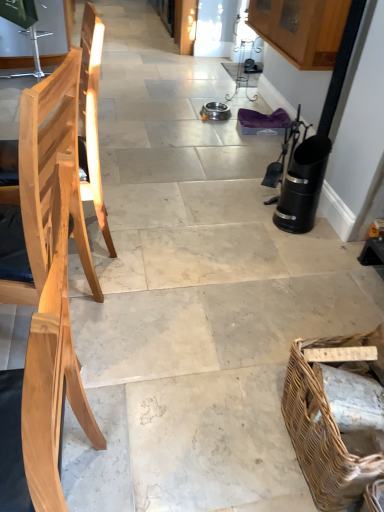
What do you see at coordinates (92, 118) in the screenshot? I see `natural wood chair at left, marked as the first chair in a back-to-front arrangement` at bounding box center [92, 118].

Locate an element on the screen. The image size is (384, 512). natural wood chair at left, acting as the first chair starting from the bottom is located at coordinates (47, 293).

The width and height of the screenshot is (384, 512). Identify the location of brown woven picnic basket at lower right. (324, 430).

In order to face brown woven picnic basket at lower right, should I rotate leftwards or rightwards?

You should look right and rotate roughly 22.971 degrees.

Where is `natural wood chair at left, which ranks as the second chair in front-to-back order`? natural wood chair at left, which ranks as the second chair in front-to-back order is located at coordinates (92, 118).

How distant is natural wood chair at left, the 2th chair in the top-to-bottom sequence, from natural wood chair at left, marked as the first chair in a back-to-front arrangement?

natural wood chair at left, the 2th chair in the top-to-bottom sequence, is 26.30 inches away from natural wood chair at left, marked as the first chair in a back-to-front arrangement.

Can you see natural wood chair at left, the 2th chair in the top-to-bottom sequence, touching natural wood chair at left, which ranks as the second chair in front-to-back order?

No, natural wood chair at left, the 2th chair in the top-to-bottom sequence, is not making contact with natural wood chair at left, which ranks as the second chair in front-to-back order.

This screenshot has width=384, height=512. In order to click on chair located on the left of natural wood chair at left, the 1th chair when ordered from front to back in this screenshot , I will do `click(92, 118)`.

From the image's perspective, is natural wood chair at left, acting as the first chair starting from the bottom, beneath natural wood chair at left, which ranks as the second chair in front-to-back order?

Indeed, from the image's perspective, natural wood chair at left, acting as the first chair starting from the bottom, is shown beneath natural wood chair at left, which ranks as the second chair in front-to-back order.

Considering the relative sizes of natural wood chair at left, the first chair positioned from the top, and brown woven picnic basket at lower right in the image provided, is natural wood chair at left, the first chair positioned from the top, shorter than brown woven picnic basket at lower right?

In fact, natural wood chair at left, the first chair positioned from the top, may be taller than brown woven picnic basket at lower right.

From the image's perspective, which one is positioned lower, natural wood chair at left, the first chair positioned from the top, or brown woven picnic basket at lower right?

From the image's view, brown woven picnic basket at lower right is below.

In the image, there is a natural wood chair at left, the 2th chair from the bottom. Where is `picnic basket below it (from the image's perspective)`? picnic basket below it (from the image's perspective) is located at coordinates (324, 430).

Is natural wood chair at left, the first chair positioned from the top, to the left of brown woven picnic basket at lower right from the viewer's perspective?

Indeed, natural wood chair at left, the first chair positioned from the top, is positioned on the left side of brown woven picnic basket at lower right.

In order to click on picnic basket that is on the right side of natural wood chair at left, the 2th chair in the top-to-bottom sequence in this screenshot , I will do `click(324, 430)`.

Who is shorter, brown woven picnic basket at lower right or natural wood chair at left, the 2th chair in the top-to-bottom sequence?

brown woven picnic basket at lower right is shorter.

Are brown woven picnic basket at lower right and natural wood chair at left, the second chair when ordered from back to front, making contact?

No.

Is natural wood chair at left, the 2th chair from the bottom, positioned with its back to natural wood chair at left, the 1th chair when ordered from front to back?

That's not correct — natural wood chair at left, the 2th chair from the bottom, is not looking away from natural wood chair at left, the 1th chair when ordered from front to back.

Measure the distance from natural wood chair at left, which ranks as the second chair in front-to-back order, to natural wood chair at left, acting as the first chair starting from the bottom.

natural wood chair at left, which ranks as the second chair in front-to-back order, and natural wood chair at left, acting as the first chair starting from the bottom, are 26.30 inches apart from each other.

From the image's perspective, is natural wood chair at left, the first chair positioned from the top, positioned above or below natural wood chair at left, the 2th chair in the top-to-bottom sequence?

Result: From the image's perspective, natural wood chair at left, the first chair positioned from the top, appears above natural wood chair at left, the 2th chair in the top-to-bottom sequence.

Who is taller, natural wood chair at left, which ranks as the second chair in front-to-back order, or natural wood chair at left, the 2th chair in the top-to-bottom sequence?

natural wood chair at left, the 2th chair in the top-to-bottom sequence, is taller.

From their relative heights in the image, would you say natural wood chair at left, the 2th chair in the top-to-bottom sequence, is taller or shorter than brown woven picnic basket at lower right?

Considering their sizes, natural wood chair at left, the 2th chair in the top-to-bottom sequence, has more height than brown woven picnic basket at lower right.

In the scene shown: Does natural wood chair at left, the 1th chair when ordered from front to back, have a greater width compared to brown woven picnic basket at lower right?

No, natural wood chair at left, the 1th chair when ordered from front to back, is not wider than brown woven picnic basket at lower right.

Is brown woven picnic basket at lower right at the back of natural wood chair at left, the second chair when ordered from back to front?

Yes.

Between natural wood chair at left, acting as the first chair starting from the bottom, and brown woven picnic basket at lower right, which one is positioned behind?

brown woven picnic basket at lower right.

Can you tell me how much brown woven picnic basket at lower right and natural wood chair at left, the first chair positioned from the top, differ in facing direction?

brown woven picnic basket at lower right and natural wood chair at left, the first chair positioned from the top, are facing 3.63 degrees away from each other.

The height and width of the screenshot is (512, 384). There is a brown woven picnic basket at lower right. Identify the location of the 2nd chair above it (from the image's perspective). (92, 118).

Between brown woven picnic basket at lower right and natural wood chair at left, the first chair positioned from the top, which one has less height?

With less height is brown woven picnic basket at lower right.

Does brown woven picnic basket at lower right appear on the left side of natural wood chair at left, which ranks as the second chair in front-to-back order?

In fact, brown woven picnic basket at lower right is to the right of natural wood chair at left, which ranks as the second chair in front-to-back order.

Identify the location of chair lying on the left of natural wood chair at left, the 1th chair when ordered from front to back. The width and height of the screenshot is (384, 512). (92, 118).

Find the location of a particular element. The image size is (384, 512). picnic basket below the natural wood chair at left, which ranks as the second chair in front-to-back order (from a real-world perspective) is located at coordinates (324, 430).

From the image, which object appears to be nearer to natural wood chair at left, the second chair when ordered from back to front, natural wood chair at left, the first chair positioned from the top, or brown woven picnic basket at lower right?

Among the two, natural wood chair at left, the first chair positioned from the top, is located nearer to natural wood chair at left, the second chair when ordered from back to front.

Based on their spatial positions, is natural wood chair at left, the 1th chair when ordered from front to back, or brown woven picnic basket at lower right further from natural wood chair at left, marked as the first chair in a back-to-front arrangement?

Among the two, brown woven picnic basket at lower right is located further to natural wood chair at left, marked as the first chair in a back-to-front arrangement.

Considering their positions, is natural wood chair at left, the 2th chair in the top-to-bottom sequence, positioned closer to brown woven picnic basket at lower right than natural wood chair at left, the first chair positioned from the top?

natural wood chair at left, the 2th chair in the top-to-bottom sequence, is positioned closer to the anchor brown woven picnic basket at lower right.

Which object lies further to the anchor point brown woven picnic basket at lower right, natural wood chair at left, marked as the first chair in a back-to-front arrangement, or natural wood chair at left, the second chair when ordered from back to front?

natural wood chair at left, marked as the first chair in a back-to-front arrangement, is further to brown woven picnic basket at lower right.

Looking at the image, which one is located closer to natural wood chair at left, the second chair when ordered from back to front, brown woven picnic basket at lower right or natural wood chair at left, which ranks as the second chair in front-to-back order?

Based on the image, natural wood chair at left, which ranks as the second chair in front-to-back order, appears to be nearer to natural wood chair at left, the second chair when ordered from back to front.

Estimate the real-world distances between objects in this image. Which object is further from natural wood chair at left, marked as the first chair in a back-to-front arrangement, brown woven picnic basket at lower right or natural wood chair at left, the 2th chair in the top-to-bottom sequence?

Based on the image, brown woven picnic basket at lower right appears to be further to natural wood chair at left, marked as the first chair in a back-to-front arrangement.

Locate an element on the screen. The width and height of the screenshot is (384, 512). chair between natural wood chair at left, marked as the first chair in a back-to-front arrangement, and brown woven picnic basket at lower right is located at coordinates (47, 293).